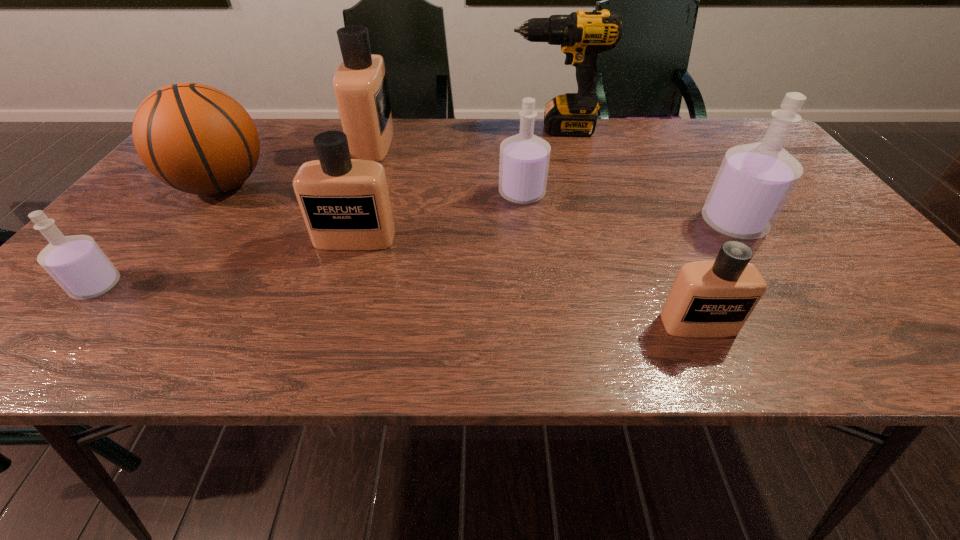
Identify the location of the smallest purple perfume. (80, 267).

The image size is (960, 540). What are the coordinates of `the second perfume from right to left` in the screenshot? It's located at 714,298.

Locate an element on the screen. The height and width of the screenshot is (540, 960). the rightmost beige perfume is located at coordinates (714, 298).

Where is `blank space located at the tip of the drill`? This screenshot has height=540, width=960. blank space located at the tip of the drill is located at coordinates (480, 129).

Identify the location of free point located 0.100m at the tip of the drill. (476, 129).

What are the coordinates of `vacant point located at the tip of the drill` in the screenshot? It's located at (434, 129).

At what (x,y) coordinates should I click in order to perform the action: click on vacant space located 0.100m on the front label of the biggest beige perfume. Please return your answer as a coordinate pair (x, y). Image resolution: width=960 pixels, height=540 pixels. Looking at the image, I should click on (426, 143).

Locate an element on the screen. vacant space located 0.280m on the left of the rightmost purple perfume is located at coordinates (580, 224).

Locate an element on the screen. vacant space located on the right of the basketball is located at coordinates click(x=318, y=185).

The image size is (960, 540). Identify the location of vacant space situated 0.180m on the right of the second purple perfume from left to right. (617, 193).